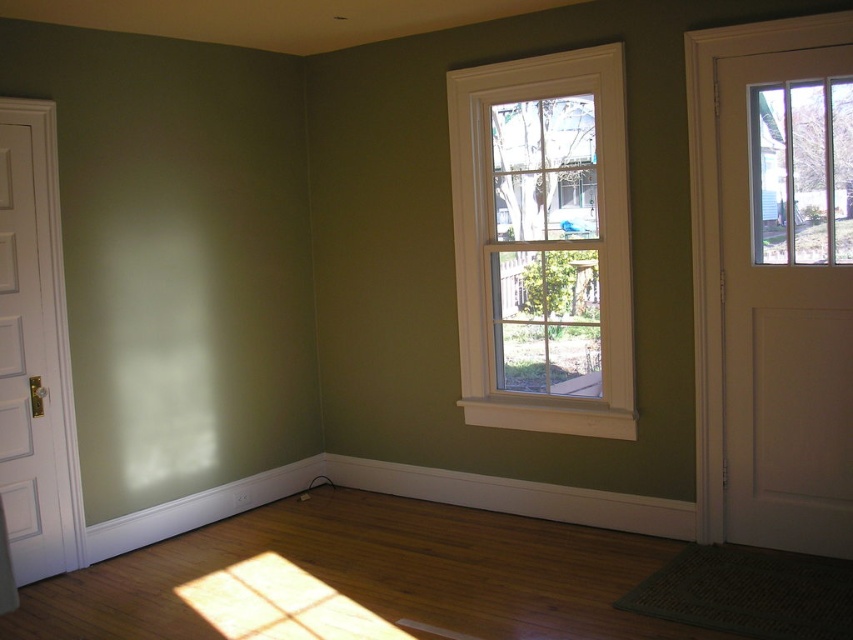
You are standing in the room and want to move from the point closer to you to the point further away. Which direction should you move? The points are labeled as point 1 at coordinates point (486,145) and point 2 at coordinates point (3,330). Please choose between moving forward, backward, left, right, up, or down.

Since point (486,145) is closer to the viewer than point (3,330), you should move backward to go from the closer point to the farther one.

You are a delivery person carrying a package that requires a 10 feet clearance to move through. You need to go from the white wood door at left to the white wood window at center. Can you navigate through the space between them without tilting the package?

The distance between the white wood window at center and the white wood door at left is 7.81 feet. Since the required clearance is 10 feet, the package cannot be moved through the space between them without tilting.

You are moving a large painting that is 1.2 meters wide. You want to hang it on the wall between the white wood window at center and the white wood door at left. Can the painting fit horizontally in that space?

The white wood window at center is bigger than the white wood door at left. Since the painting is 1.2 meters wide, the space between them may or may not be sufficient. However, without knowing the exact width of the wall space between the two objects, it is impossible to determine if the painting will fit. Please measure the distance between the white wood window at center and the white wood door at left before deciding.